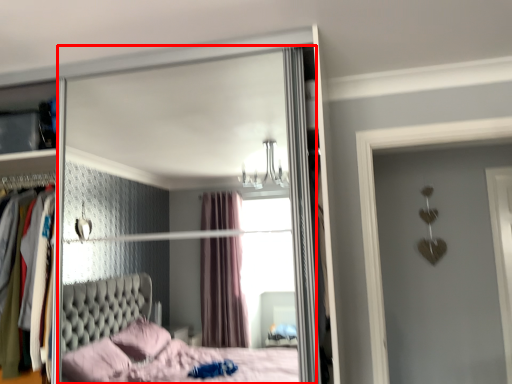
Question: From the image's perspective, what is the correct spatial positioning of mirror (annotated by the red box) in reference to dresser?

Choices:
 (A) above
 (B) below

Answer: (A)